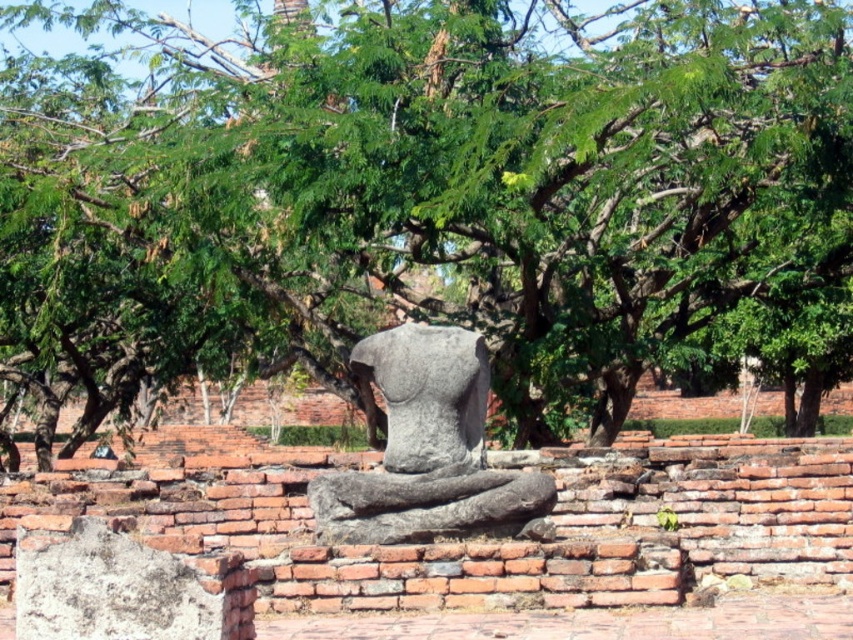
Is green leafy tree at center positioned at the back of gray stone statue at center?

Yes, it is.

Between green leafy tree at center and gray stone statue at center, which one appears on the right side from the viewer's perspective?

gray stone statue at center is more to the right.

Which is behind, point (717, 218) or point (390, 372)?

Point (717, 218)

The height and width of the screenshot is (640, 853). Identify the location of green leafy tree at center. (428, 186).